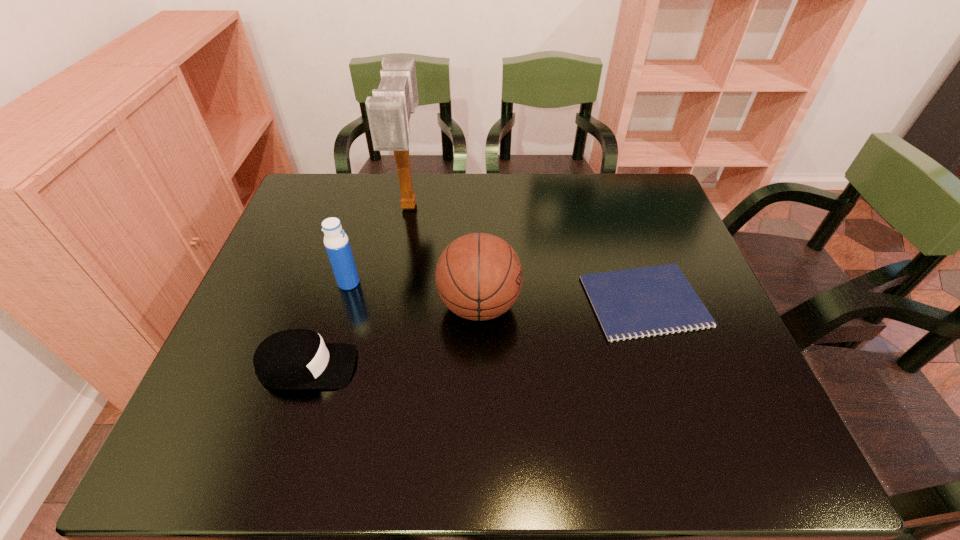
I want to click on vacant region at the far left corner, so click(322, 215).

In the image, there is a desktop. Identify the location of vacant area at the far right corner. Image resolution: width=960 pixels, height=540 pixels. (649, 181).

The width and height of the screenshot is (960, 540). I want to click on empty space that is in between the shortest object and the tallest object, so click(x=527, y=253).

Image resolution: width=960 pixels, height=540 pixels. I want to click on empty location between the second object from right to left and the notepad, so click(x=562, y=303).

You are a GUI agent. You are given a task and a screenshot of the screen. Output one action in this format:
    pyautogui.click(x=<x>, y=<y>)
    Task: Click on the empty space between the fourth tallest object and the mallet
    This screenshot has width=960, height=540.
    Given the screenshot: What is the action you would take?
    tap(358, 286)

Find the location of a particular element. Image resolution: width=960 pixels, height=540 pixels. unoccupied area between the cap and the water bottle is located at coordinates (328, 325).

You are a GUI agent. You are given a task and a screenshot of the screen. Output one action in this format:
    pyautogui.click(x=<x>, y=<y>)
    Task: Click on the vacant region between the cap and the water bottle
    
    Given the screenshot: What is the action you would take?
    pyautogui.click(x=328, y=325)

The image size is (960, 540). Identify the location of free space between the fourth object from left to right and the second shortest object. (394, 336).

Locate an element on the screen. free spot between the cap and the farthest object is located at coordinates (358, 286).

Identify the location of free space between the cap and the water bottle. This screenshot has width=960, height=540. (328, 325).